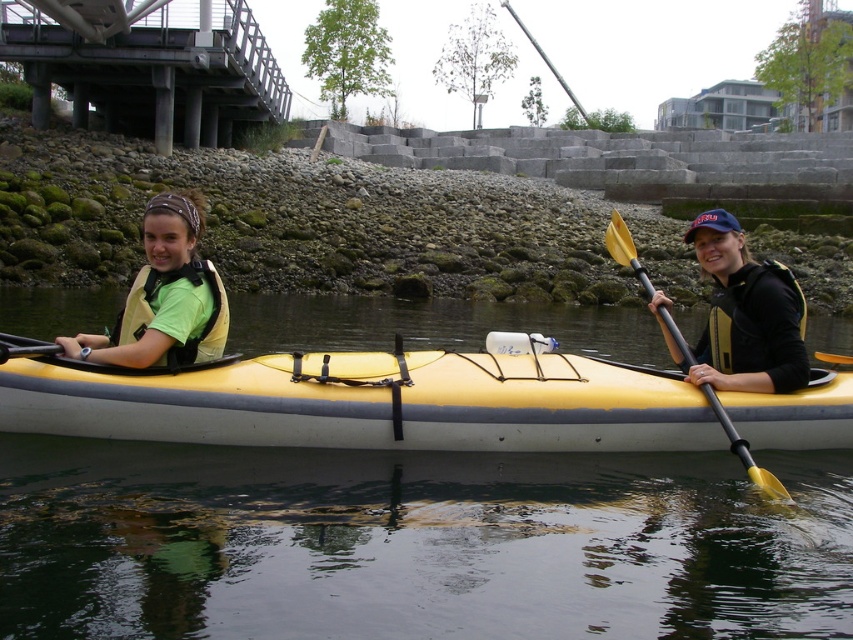
Who is more forward, (370, 378) or (125, 321)?

Point (125, 321) is more forward.

Who is positioned more to the right, yellow rubber canoe at center or matte yellow life vest at left?

Positioned to the right is yellow rubber canoe at center.

Image resolution: width=853 pixels, height=640 pixels. What are the coordinates of `yellow rubber canoe at center` in the screenshot? It's located at (368, 403).

Is matte black kayak at right below black synthetic life jacket at right?

Incorrect, matte black kayak at right is not positioned below black synthetic life jacket at right.

Consider the image. Does matte black kayak at right lie in front of black synthetic life jacket at right?

No, matte black kayak at right is further to the viewer.

Is point (779, 346) closer to viewer compared to point (792, 374)?

No, it is not.

Locate an element on the screen. matte black kayak at right is located at coordinates (744, 316).

Can you confirm if yellow rubber kayak at center is positioned above matte black kayak at right?

Actually, yellow rubber kayak at center is below matte black kayak at right.

Is point (271, 518) closer to camera compared to point (778, 276)?

Yes, it is in front of point (778, 276).

Is point (486, 577) positioned before point (773, 289)?

Yes, point (486, 577) is closer to viewer.

The width and height of the screenshot is (853, 640). In order to click on yellow rubber kayak at center in this screenshot , I will do `click(415, 544)`.